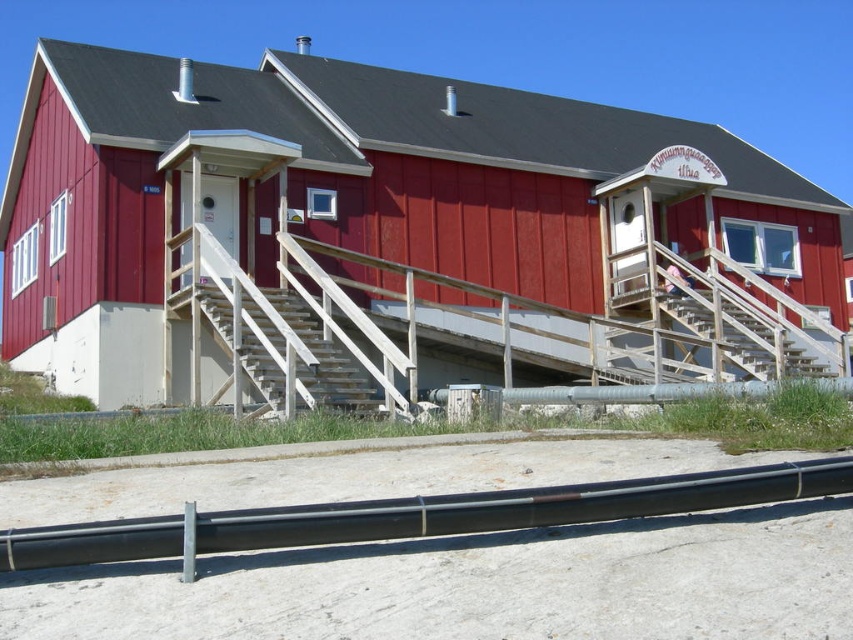
Based on the photo, is black metal rail at lower center to the left of wooden stairs at lower right from the viewer's perspective?

Yes, black metal rail at lower center is to the left of wooden stairs at lower right.

Who is taller, black metal rail at lower center or wooden stairs at lower right?

Standing taller between the two is wooden stairs at lower right.

Does point (4, 570) lie behind point (833, 374)?

No, it is not.

You are a GUI agent. You are given a task and a screenshot of the screen. Output one action in this format:
    pyautogui.click(x=<x>, y=<y>)
    Task: Click on the black metal rail at lower center
    The height and width of the screenshot is (640, 853).
    Given the screenshot: What is the action you would take?
    pyautogui.click(x=415, y=515)

Is point (85, 268) in front of point (245, 326)?

No, it is behind (245, 326).

Looking at this image, which of these two, smooth red wooden hut at center or wooden stairs at center, stands taller?

Standing taller between the two is smooth red wooden hut at center.

Who is more distant from viewer, (448, 140) or (352, 401)?

The point (448, 140) is more distant.

Locate an element on the screen. smooth red wooden hut at center is located at coordinates (387, 228).

Is smooth red wooden hut at center further to the viewer compared to black metal rail at lower center?

That is True.

Is smooth red wooden hut at center below black metal rail at lower center?

No.

Between point (183, 385) and point (189, 509), which one is positioned behind?

The point (183, 385) is more distant.

Locate an element on the screen. The image size is (853, 640). smooth red wooden hut at center is located at coordinates (387, 228).